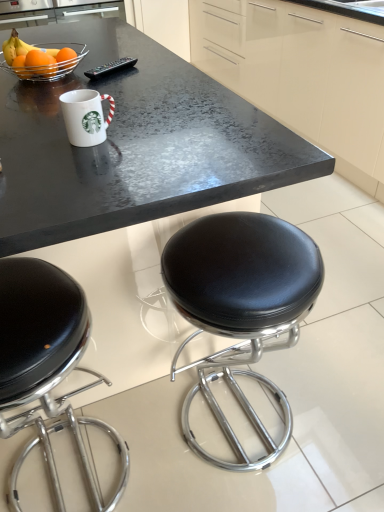
Question: From a real-world perspective, is white glossy mug at upper center located beneath metallic wire basket at upper left?

Choices:
 (A) yes
 (B) no

Answer: (B)

Question: Does white glossy mug at upper center turn towards metallic wire basket at upper left?

Choices:
 (A) no
 (B) yes

Answer: (A)

Question: From a real-world perspective, is white glossy mug at upper center over metallic wire basket at upper left?

Choices:
 (A) yes
 (B) no

Answer: (A)

Question: Does white glossy mug at upper center have a greater width compared to metallic wire basket at upper left?

Choices:
 (A) yes
 (B) no

Answer: (B)

Question: Is white glossy mug at upper center positioned behind metallic wire basket at upper left?

Choices:
 (A) no
 (B) yes

Answer: (A)

Question: Is metallic wire basket at upper left inside white glossy mug at upper center?

Choices:
 (A) yes
 (B) no

Answer: (B)

Question: Is black leather stool at lower left surrounded by glossy cream cabinetry at upper center?

Choices:
 (A) yes
 (B) no

Answer: (B)

Question: Is the position of glossy cream cabinetry at upper center less distant than that of black leather stool at lower left?

Choices:
 (A) no
 (B) yes

Answer: (A)

Question: From the image's perspective, is glossy cream cabinetry at upper center on top of black leather stool at lower left?

Choices:
 (A) yes
 (B) no

Answer: (A)

Question: Is glossy cream cabinetry at upper center positioned beyond the bounds of black leather stool at lower left?

Choices:
 (A) yes
 (B) no

Answer: (A)

Question: Considering the relative sizes of glossy cream cabinetry at upper center and black leather stool at lower left in the image provided, is glossy cream cabinetry at upper center thinner than black leather stool at lower left?

Choices:
 (A) no
 (B) yes

Answer: (A)

Question: From the image's perspective, would you say glossy cream cabinetry at upper center is shown under black leather stool at lower left?

Choices:
 (A) no
 (B) yes

Answer: (A)

Question: Is metallic wire basket at upper left to the left of black leather stool at lower left from the viewer's perspective?

Choices:
 (A) yes
 (B) no

Answer: (A)